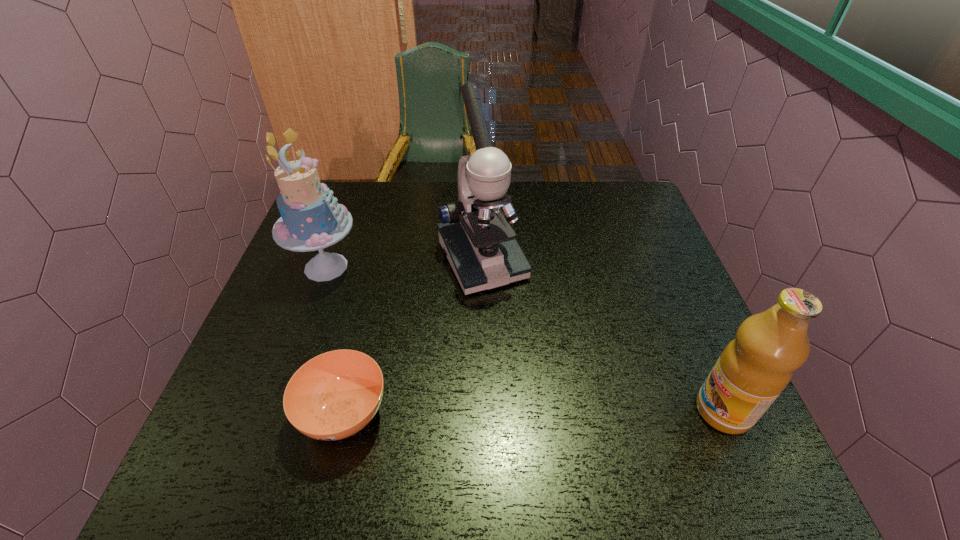
This screenshot has width=960, height=540. What are the coordinates of `vacant space that's between the second tallest object and the second object from right to left` in the screenshot? It's located at (404, 264).

Where is `free spot between the microscope and the rightmost object`? This screenshot has height=540, width=960. free spot between the microscope and the rightmost object is located at coordinates (603, 336).

This screenshot has height=540, width=960. Identify the location of vacant space that is in between the cake and the microscope. (404, 264).

Locate an element on the screen. unoccupied position between the rightmost object and the third shortest object is located at coordinates (525, 339).

I want to click on unoccupied area between the cake and the microscope, so click(404, 264).

This screenshot has width=960, height=540. Find the location of `free space that is in between the microscope and the second shortest object`. free space that is in between the microscope and the second shortest object is located at coordinates point(603,336).

Image resolution: width=960 pixels, height=540 pixels. In order to click on empty space that is in between the second tallest object and the third tallest object in this screenshot , I will do `click(525, 339)`.

Locate an element on the screen. The width and height of the screenshot is (960, 540). vacant point located between the shortest object and the rightmost object is located at coordinates (534, 412).

Where is `object that can be found as the closest to the shortest object`? object that can be found as the closest to the shortest object is located at coordinates click(x=477, y=239).

In order to click on object that can be found as the third closest to the rightmost object in this screenshot , I will do `click(311, 219)`.